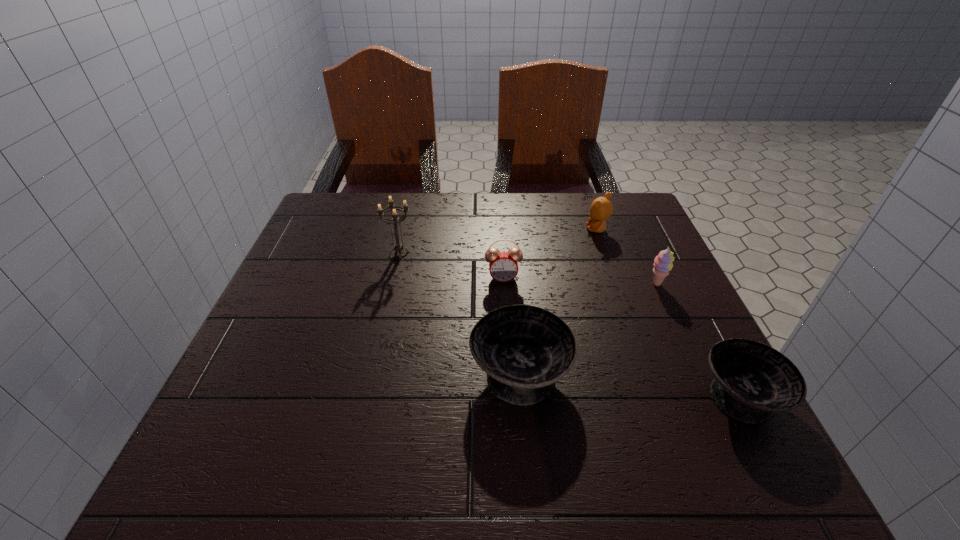
Find the location of a particular element. This screenshot has width=960, height=540. vacant space that satisfies the following two spatial constraints: 1. on the back side of the right bowl; 2. on the face of the teddy bear is located at coordinates (655, 230).